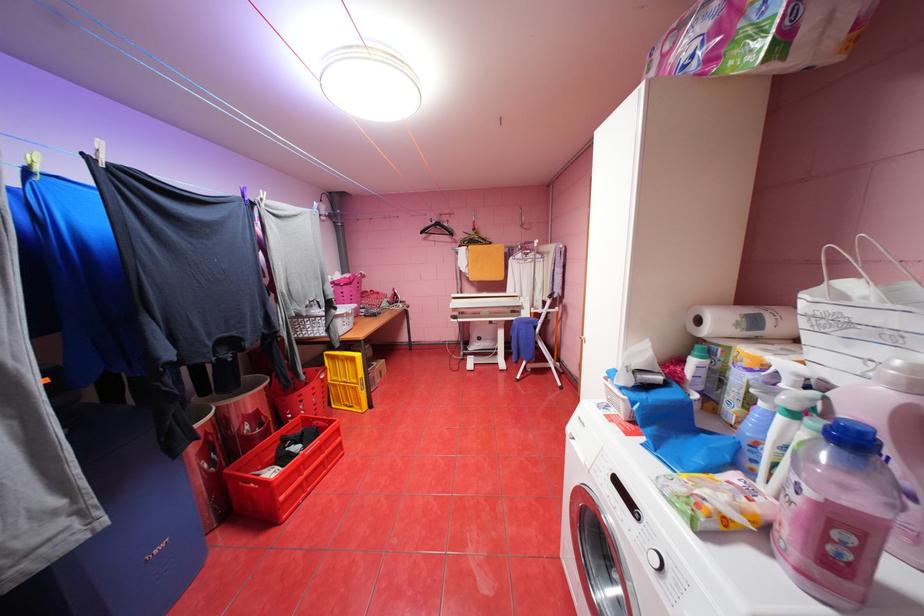
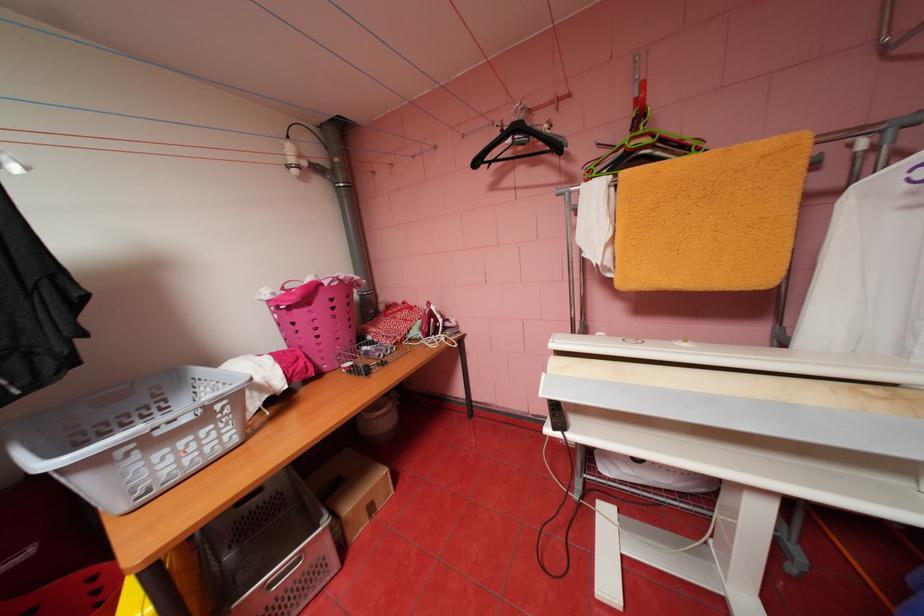
Where in the second image is the point corresponding to point 431,232 from the first image?

(484, 163)